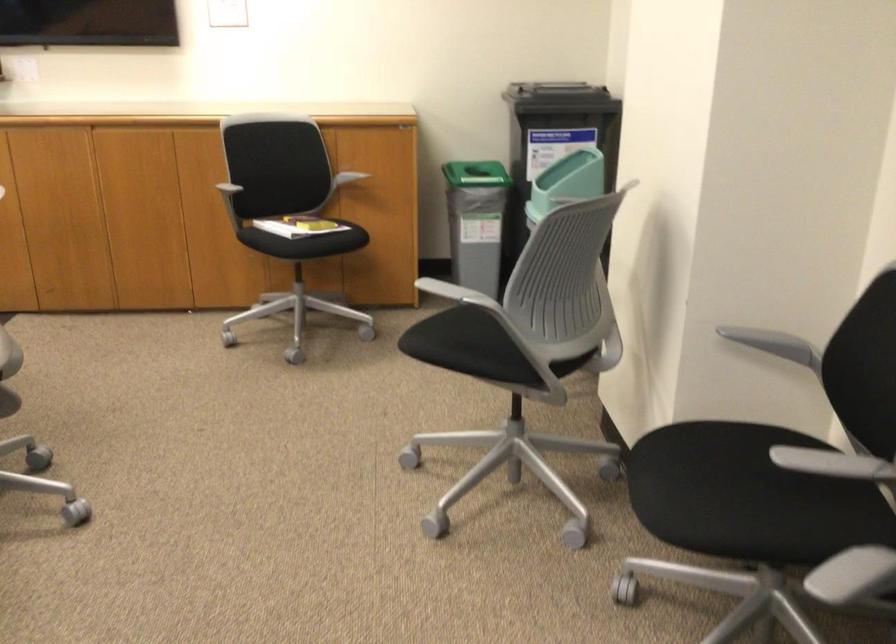
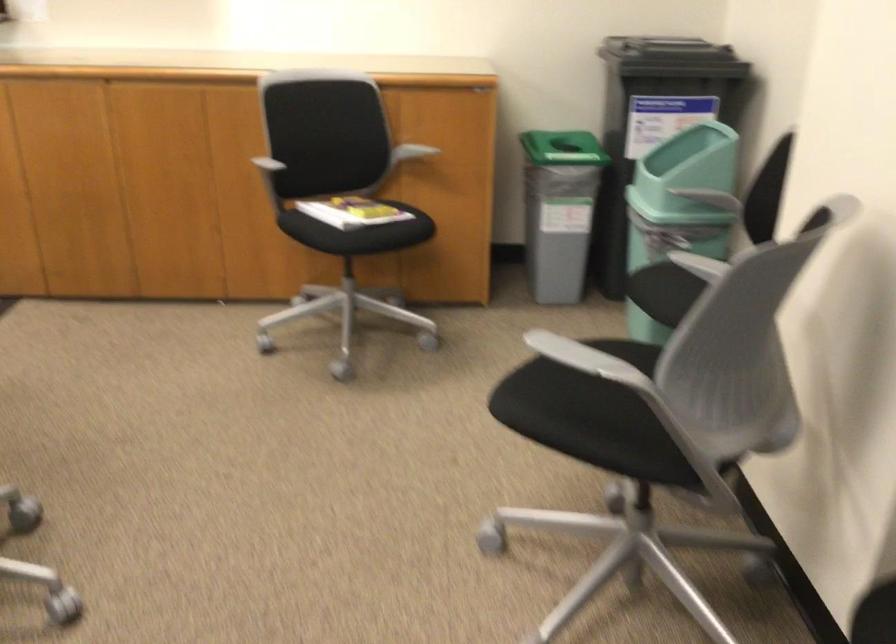
Find the pixel in the second image that matches point (478, 339) in the first image.

(599, 406)